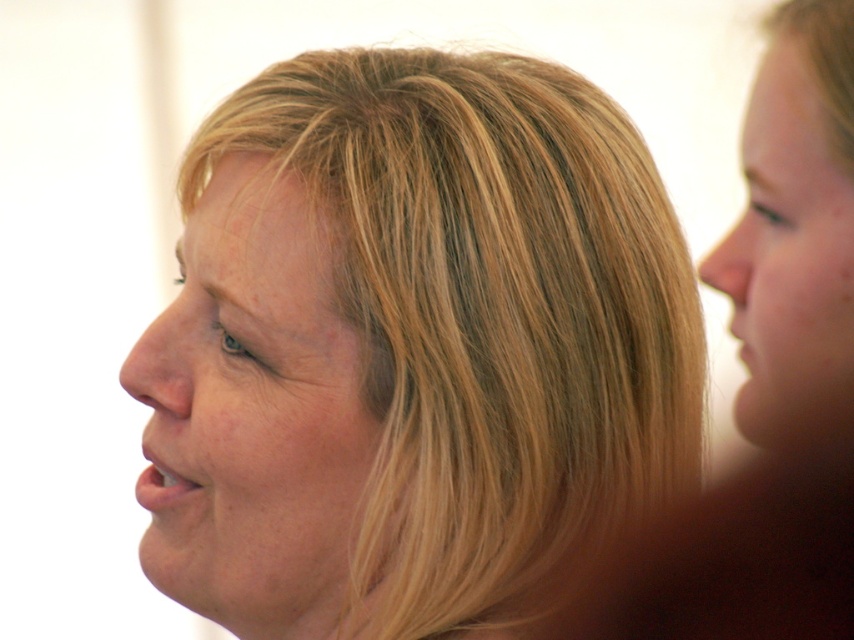
You are a photographer setting up a lighting rig for a portrait session. You need to ensure that both the smooth skin face at center and the smooth skin face at right are evenly lit. Based on their current positions, which face might require additional lighting adjustments?

The smooth skin face at center is positioned under smooth skin face at right. Since it is lower in the frame, it might be in a shadowed area and require additional lighting adjustments to ensure even illumination.

You are a photographer standing at a certain distance from the smooth skin face at center. You want to take a closeup portrait without moving the subject. Can you move closer to the subject to achieve this?

The smooth skin face at center is 26.87 inches away from the viewer. To take a closeup portrait without moving the subject, you would need to move closer than 26.87 inches. However, since the current distance is already set, you might need to adjust your camera settings or use a zoom lens instead of moving closer.